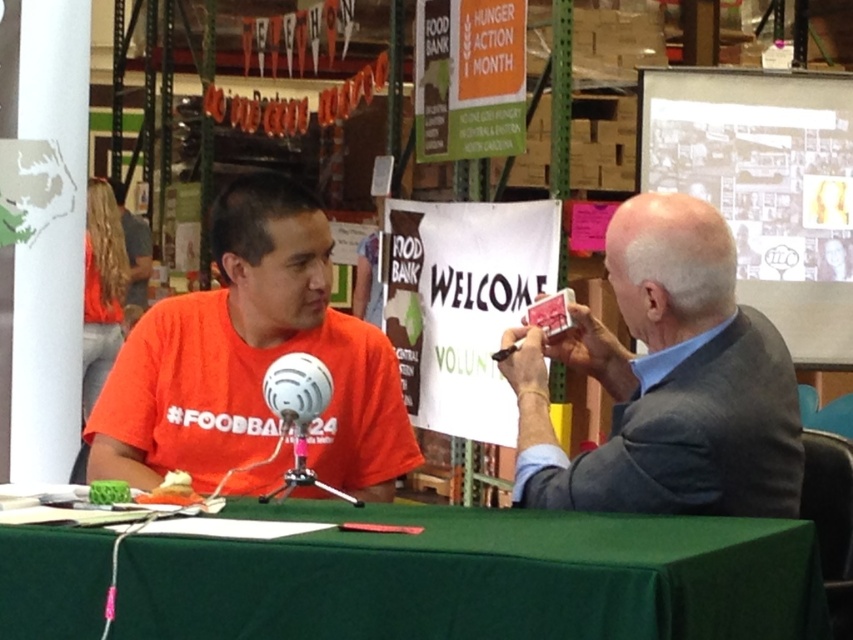
You are standing at the center of the scene. Which direction should you move to reach the gray fabric suit at right?

Since the gray fabric suit at right is located at coordinates approximately 0.597 on the x and 0.782 on the y axis, you should move towards the right and slightly forward to reach it.

You are standing in front of the table at the community event. There are two points marked on the table. The first point is at coordinates point (701, 410) and the second point is at point (283, 321). Which point is closer to you?

Point (701, 410) is closer to the viewer than point (283, 321).